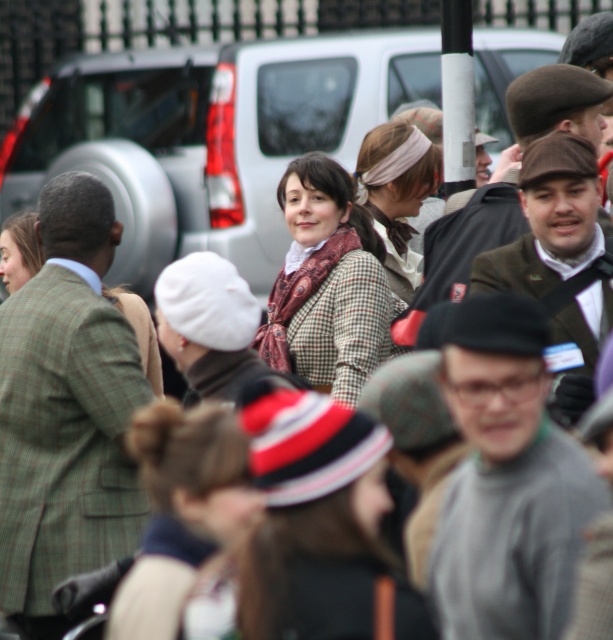
You are standing in the crowd and want to locate the plaid wool coat at center and the matte brown coat at center. Which one is positioned more to the right side of the scene?

The plaid wool coat at center is to the right of the matte brown coat at center, so the plaid wool coat at center is positioned more to the right side of the scene.

Based on the photo, you are a photographer trying to capture a shot of both the gray wool sweater at center and the matte brown coat at center. Since you want to ensure both are in frame, can you confirm which one is on the right side?

The gray wool sweater at center is positioned on the right side of matte brown coat at center, so the gray wool sweater at center is on the right.